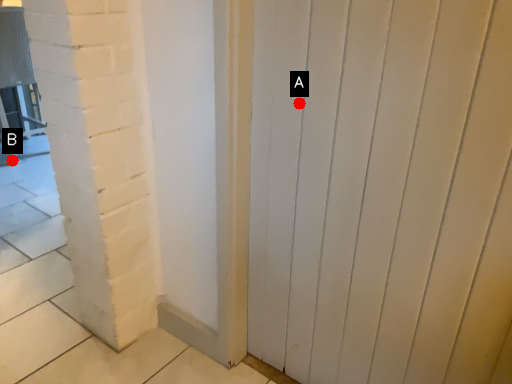
Question: Two points are circled on the image, labeled by A and B beside each circle. Which point is closer to the camera?

Choices:
 (A) A is closer
 (B) B is closer

Answer: (A)